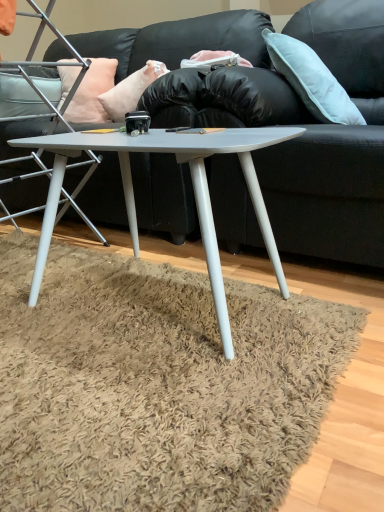
Question: Looking at the image, does matte gray coffee table at center seem bigger or smaller compared to metallic silver chair at left?

Choices:
 (A) big
 (B) small

Answer: (B)

Question: Looking at their shapes, would you say matte gray coffee table at center is wider or thinner than metallic silver chair at left?

Choices:
 (A) thin
 (B) wide

Answer: (A)

Question: Estimate the real-world distances between objects in this image. Which object is closer to the metallic silver chair at left?

Choices:
 (A) light blue fabric pillow at upper right, the first pillow from the right
 (B) matte gray coffee table at center
 (C) pink fabric pillow at upper left, the 2th pillow positioned from the right
 (D) peachy fabric pillow at upper left, the third pillow when ordered from right to left
 (E) black leather couch at center

Answer: (D)

Question: Which is farther from the metallic silver chair at left?

Choices:
 (A) light blue fabric pillow at upper right, which is counted as the third pillow, starting from the left
 (B) pink fabric pillow at upper left, the 2th pillow positioned from the right
 (C) matte gray coffee table at center
 (D) peachy fabric pillow at upper left, the third pillow when ordered from right to left
 (E) black leather couch at center

Answer: (A)